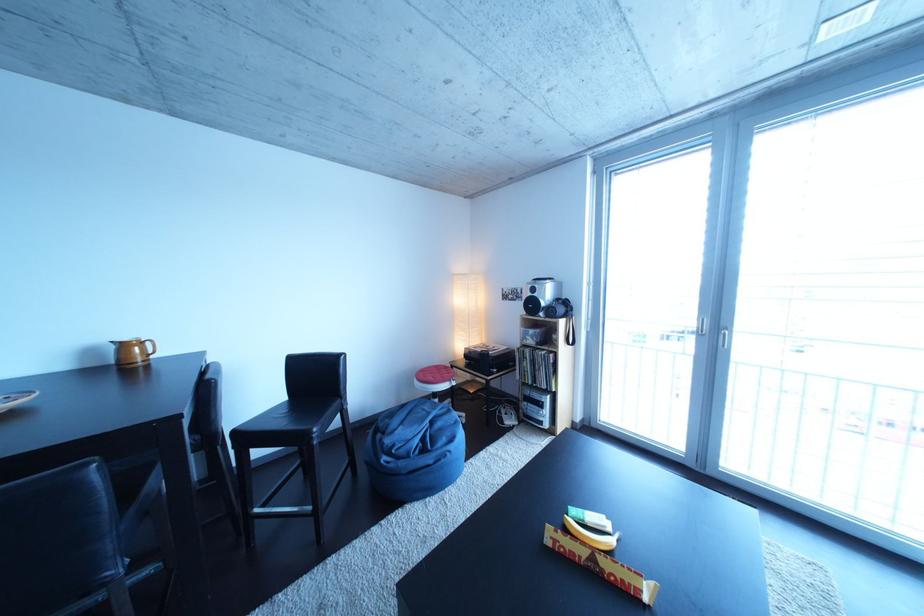
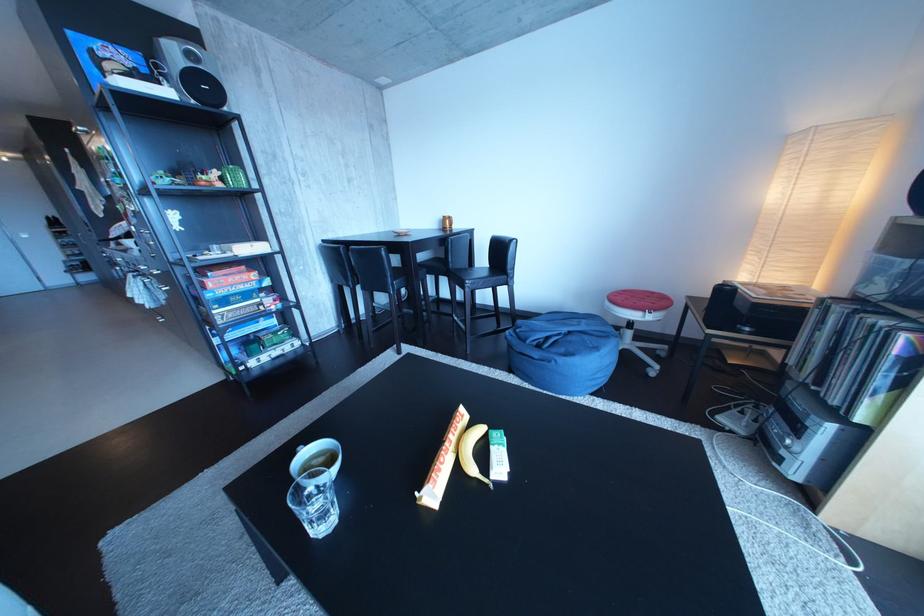
In the second image, find the point that corresponds to the point at 450,371 in the first image.

(666, 299)